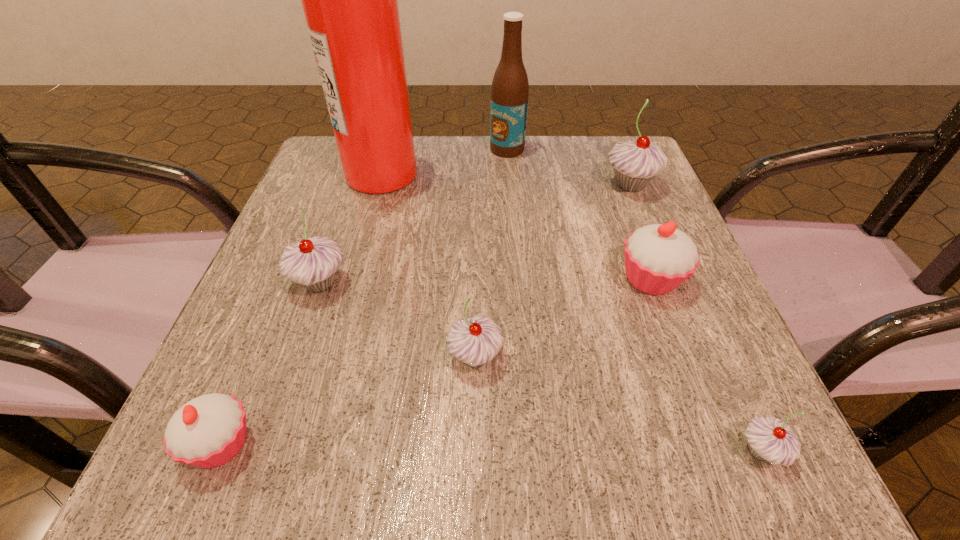
Image resolution: width=960 pixels, height=540 pixels. Find the location of `the smallest gray cupcake`. the smallest gray cupcake is located at coordinates (770, 439).

Locate an element on the screen. This screenshot has width=960, height=540. the smaller pink cupcake is located at coordinates (208, 431).

Locate an element on the screen. the nearer pink cupcake is located at coordinates (208, 431).

Find the location of `vacant area situated at the nozzle of the fire extinguisher`. vacant area situated at the nozzle of the fire extinguisher is located at coordinates (x=463, y=173).

The height and width of the screenshot is (540, 960). I want to click on vacant point located 0.330m on the left of the beer bottle, so click(350, 149).

Locate an element on the screen. The image size is (960, 540). blank space located 0.160m on the left of the sixth shortest object is located at coordinates (528, 185).

Identify the location of vacant space located on the front of the leftmost gray cupcake. This screenshot has width=960, height=540. (257, 463).

The height and width of the screenshot is (540, 960). In order to click on free region located 0.310m on the back of the farther pink cupcake in this screenshot , I will do `click(608, 162)`.

At what (x,y) coordinates should I click in order to perform the action: click on vacant space located 0.220m on the back of the fourth cupcake from right to left. Please return your answer as a coordinate pair (x, y). Looking at the image, I should click on (476, 239).

Image resolution: width=960 pixels, height=540 pixels. I want to click on free space located on the back of the nearest gray cupcake, so click(x=689, y=289).